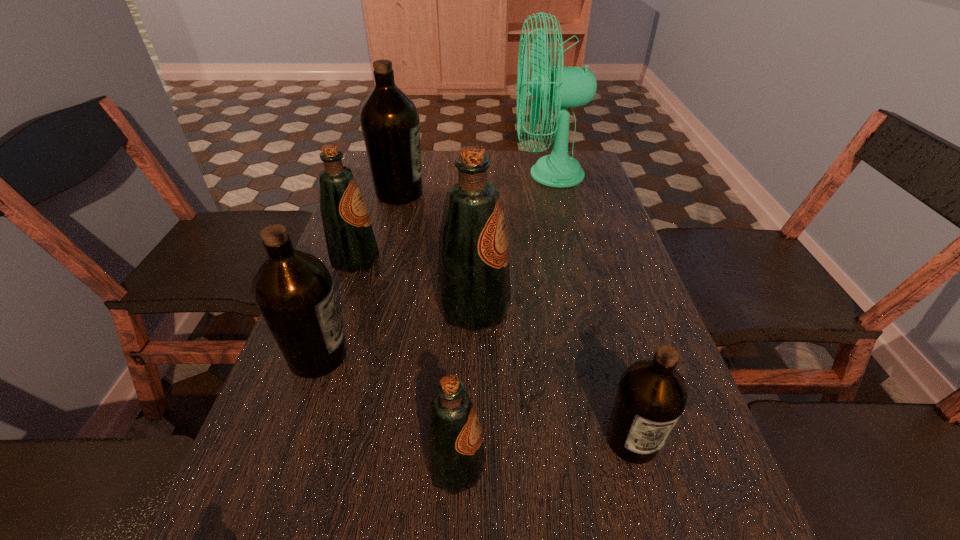
The width and height of the screenshot is (960, 540). What are the coordinates of `fan present at the far edge` in the screenshot? It's located at (568, 87).

At what (x,y) coordinates should I click in order to perform the action: click on olive oil located in the far edge section of the desktop. Please return your answer as a coordinate pair (x, y). This screenshot has height=540, width=960. Looking at the image, I should click on (389, 120).

I want to click on fan situated at the right edge, so click(x=568, y=87).

Find the location of a particular element. olive oil present at the right edge is located at coordinates (652, 395).

Find the location of `object that is at the far left corner`. object that is at the far left corner is located at coordinates (389, 120).

Locate an element on the screen. Image resolution: width=960 pixels, height=540 pixels. object that is at the far right corner is located at coordinates (568, 87).

You are a GUI agent. You are given a task and a screenshot of the screen. Output one action in this format:
    pyautogui.click(x=<x>, y=<y>)
    Task: Click on the vacant space at the far edge of the desktop
    Image resolution: width=960 pixels, height=540 pixels.
    Given the screenshot: What is the action you would take?
    click(452, 161)

Locate an element on the screen. This screenshot has width=960, height=540. free region at the left edge is located at coordinates (289, 500).

Where is `vacant space at the right edge`? vacant space at the right edge is located at coordinates (605, 296).

Identify the location of free area in between the second nearest brown olive oil and the farthest brown olive oil. The width and height of the screenshot is (960, 540). (359, 274).